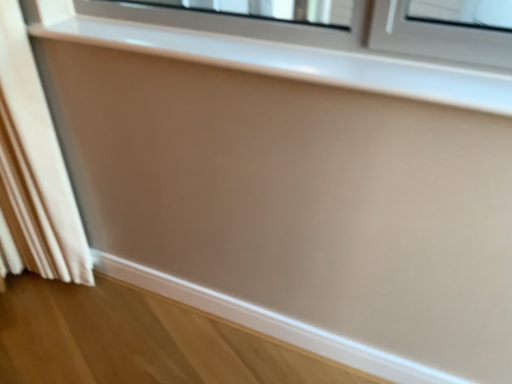
Question: Is white fabric curtain at left further to camera compared to matte white window sill at upper center?

Choices:
 (A) no
 (B) yes

Answer: (B)

Question: Can you confirm if white fabric curtain at left is thinner than matte white window sill at upper center?

Choices:
 (A) yes
 (B) no

Answer: (B)

Question: From the image's perspective, would you say white fabric curtain at left is shown under matte white window sill at upper center?

Choices:
 (A) no
 (B) yes

Answer: (B)

Question: Considering the relative sizes of white fabric curtain at left and matte white window sill at upper center in the image provided, is white fabric curtain at left taller than matte white window sill at upper center?

Choices:
 (A) yes
 (B) no

Answer: (A)

Question: Considering the relative positions of white fabric curtain at left and matte white window sill at upper center in the image provided, is white fabric curtain at left in front of matte white window sill at upper center?

Choices:
 (A) no
 (B) yes

Answer: (A)

Question: Can you confirm if white fabric curtain at left is wider than matte white window sill at upper center?

Choices:
 (A) yes
 (B) no

Answer: (A)

Question: Can you confirm if matte white window sill at upper center is smaller than white fabric curtain at left?

Choices:
 (A) no
 (B) yes

Answer: (B)

Question: Is matte white window sill at upper center to the right of white fabric curtain at left from the viewer's perspective?

Choices:
 (A) yes
 (B) no

Answer: (A)

Question: Is matte white window sill at upper center touching white fabric curtain at left?

Choices:
 (A) no
 (B) yes

Answer: (A)

Question: Is matte white window sill at upper center wider than white fabric curtain at left?

Choices:
 (A) yes
 (B) no

Answer: (B)

Question: Is matte white window sill at upper center positioned in front of white fabric curtain at left?

Choices:
 (A) yes
 (B) no

Answer: (A)

Question: Does matte white window sill at upper center have a lesser height compared to white fabric curtain at left?

Choices:
 (A) no
 (B) yes

Answer: (B)

Question: From a real-world perspective, relative to white fabric curtain at left, is matte white window sill at upper center vertically above or below?

Choices:
 (A) below
 (B) above

Answer: (B)